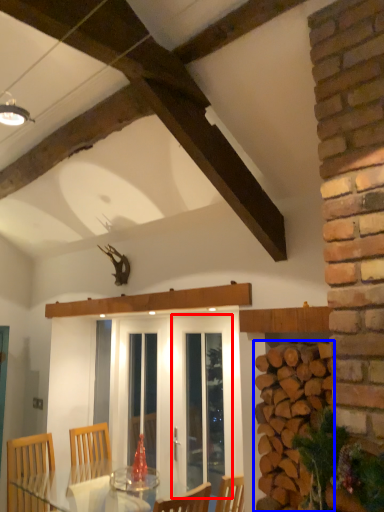
Question: Among these objects, which one is farthest to the camera, screen door (highlighted by a red box) or brickwork (highlighted by a blue box)?

Choices:
 (A) screen door
 (B) brickwork

Answer: (A)